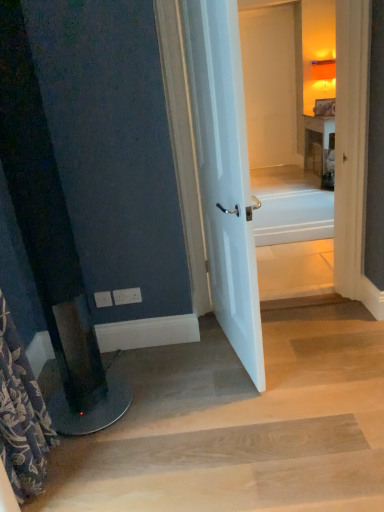
Find the location of `spots to the right of floral fabric shower curtain at left`. spots to the right of floral fabric shower curtain at left is located at coordinates (106, 468).